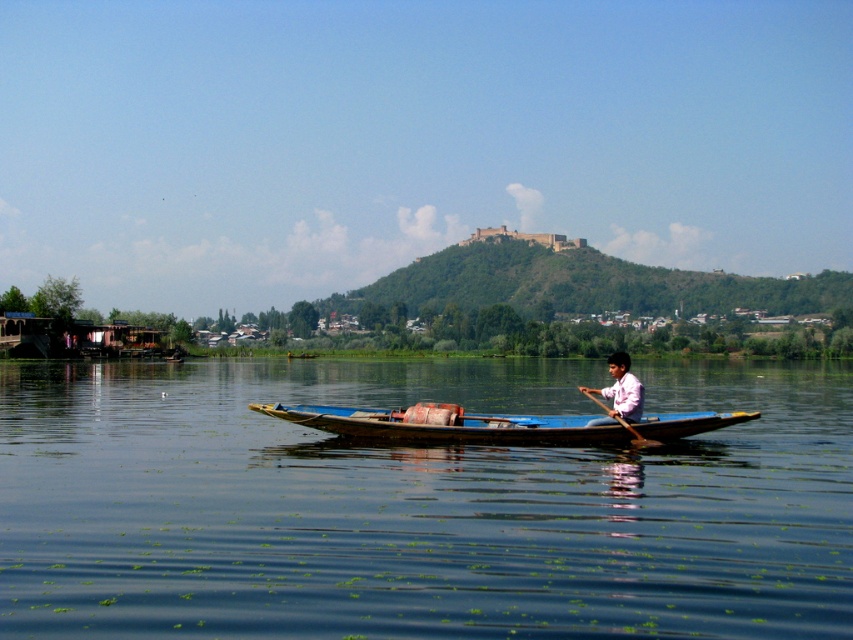
You are a photographer trying to capture the blue wooden boat at center and the wooden at center in the same frame. Since you want both objects to be fully visible, which one should you focus on first to ensure the taller object is in focus?

The blue wooden boat at center is taller than wooden at center, so you should focus on the blue wooden boat at center first to ensure it is in focus before adjusting for the shorter wooden at center.

You are a photographer trying to capture the pink cotton shirt at center and the wooden at center in a single shot. Since you want both objects to be clearly visible, which one should you focus on first to ensure it appears sharp in the photo?

You should focus on the pink cotton shirt at center first because it is larger in size than the wooden at center, making it more prominent and easier to capture clearly.